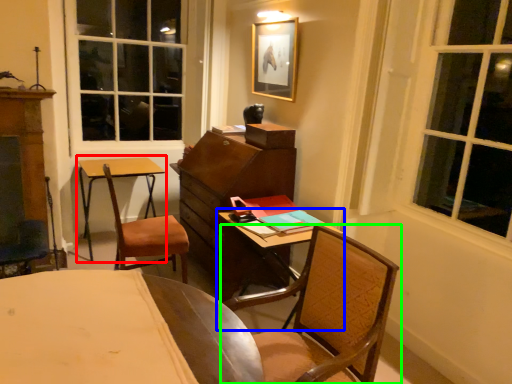
Question: Which object is the farthest from round table (highlighted by a red box)? Choose among these: table (highlighted by a blue box) or chair (highlighted by a green box).

Choices:
 (A) table
 (B) chair

Answer: (B)